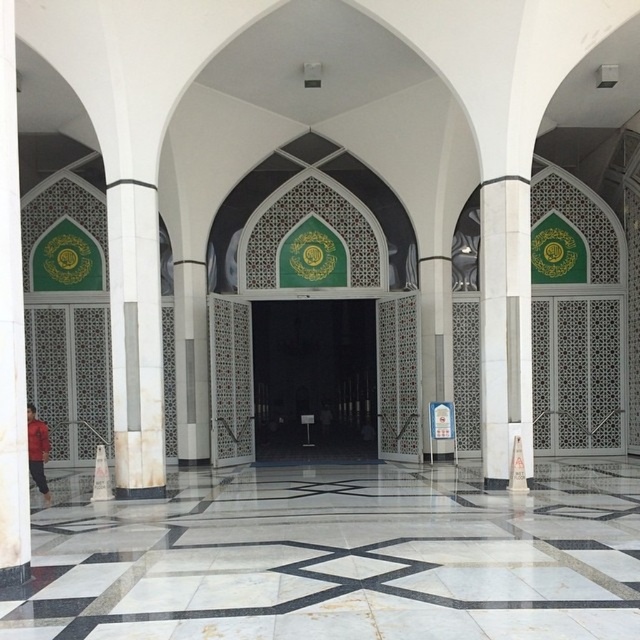
Between transparent glass door at center and white marble pillar at left, which one appears on the right side from the viewer's perspective?

transparent glass door at center

You are a GUI agent. You are given a task and a screenshot of the screen. Output one action in this format:
    pyautogui.click(x=<x>, y=<y>)
    Task: Click on the transparent glass door at center
    
    Given the screenshot: What is the action you would take?
    pyautogui.click(x=314, y=380)

Identify the location of transparent glass door at center. The image size is (640, 640). (314, 380).